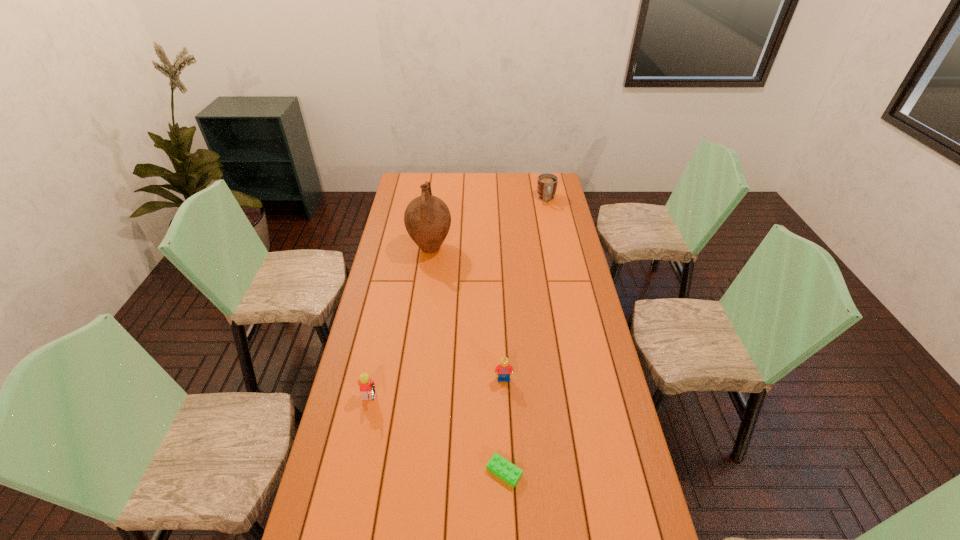
Find the location of a particular element. The height and width of the screenshot is (540, 960). free location that satisfies the following two spatial constraints: 1. on the front side of the shortest Lego; 2. on the right side of the tallest object is located at coordinates (400, 472).

This screenshot has width=960, height=540. I want to click on vacant space that satisfies the following two spatial constraints: 1. on the side of the mug with the handle; 2. in front of the second nearest object with the accessory visible, so click(x=588, y=402).

Identify the location of vacant space that satisfies the following two spatial constraints: 1. on the face of the third farthest object; 2. in front of the fourth farthest object with the accessory visible. The height and width of the screenshot is (540, 960). (505, 402).